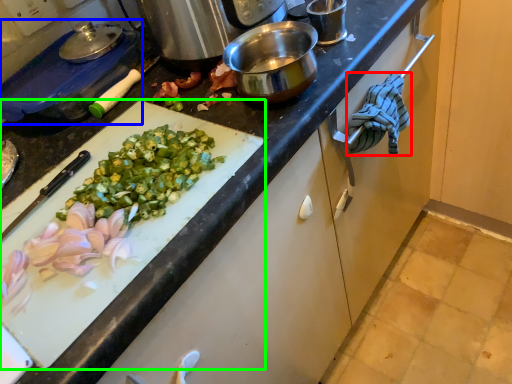
Question: Considering the real-world distances, which object is farthest from cloth (highlighted by a red box)? kitchen appliance (highlighted by a blue box) or cutting board (highlighted by a green box)?

Choices:
 (A) kitchen appliance
 (B) cutting board

Answer: (A)